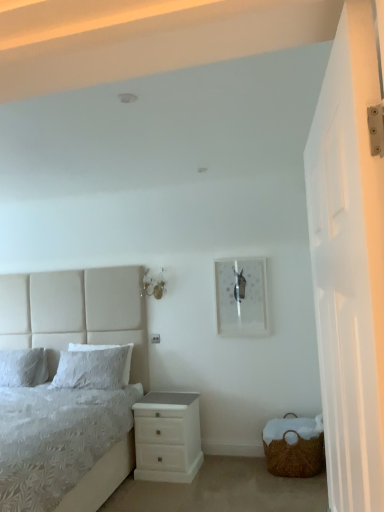
Where is `white soft pillow at left, which ranks as the 1th pillow in right-to-left order`? white soft pillow at left, which ranks as the 1th pillow in right-to-left order is located at coordinates (93, 367).

This screenshot has height=512, width=384. In order to click on metallic silver picture frame at center in this screenshot , I will do `click(241, 297)`.

The height and width of the screenshot is (512, 384). Describe the element at coordinates (76, 313) in the screenshot. I see `white fabric bed at left` at that location.

The height and width of the screenshot is (512, 384). I want to click on white fabric bed at left, so click(76, 313).

Describe the element at coordinates (293, 447) in the screenshot. This screenshot has width=384, height=512. I see `woven brown basket at lower right` at that location.

At what (x,y) coordinates should I click in order to perform the action: click on woven brown basket at lower right. Please return your answer as a coordinate pair (x, y). This screenshot has height=512, width=384. Looking at the image, I should click on point(293,447).

The height and width of the screenshot is (512, 384). Find the location of `white soft pillow at left, the 2th pillow in the right-to-left sequence`. white soft pillow at left, the 2th pillow in the right-to-left sequence is located at coordinates (x=23, y=367).

The height and width of the screenshot is (512, 384). In order to click on white glossy chest of drawers at lower right in this screenshot , I will do (167, 437).

Does metallic silver picture frame at center turn towards white fabric bed at left?

No, metallic silver picture frame at center is not turned towards white fabric bed at left.

Is metallic silver picture frame at center shorter than white fabric bed at left?

Yes, metallic silver picture frame at center is shorter than white fabric bed at left.

The height and width of the screenshot is (512, 384). I want to click on bed that is in front of the metallic silver picture frame at center, so click(76, 313).

Can you confirm if metallic silver picture frame at center is smaller than white fabric bed at left?

→ Indeed, metallic silver picture frame at center has a smaller size compared to white fabric bed at left.

In the scene shown: Is white soft pillow at left, the 2th pillow in the right-to-left sequence, positioned beyond the bounds of white glossy door at right?

Absolutely, white soft pillow at left, the 2th pillow in the right-to-left sequence, is external to white glossy door at right.

Considering the relative positions of white soft pillow at left, the 2th pillow in the right-to-left sequence, and white glossy door at right in the image provided, is white soft pillow at left, the 2th pillow in the right-to-left sequence, to the left of white glossy door at right from the viewer's perspective?

Indeed, white soft pillow at left, the 2th pillow in the right-to-left sequence, is positioned on the left side of white glossy door at right.

From a real-world perspective, is white soft pillow at left, marked as the 1th pillow in a left-to-right arrangement, located beneath white glossy door at right?

Indeed, from a real-world perspective, white soft pillow at left, marked as the 1th pillow in a left-to-right arrangement, is positioned beneath white glossy door at right.

Which of these two, white soft pillow at left, the 2th pillow in the right-to-left sequence, or white glossy door at right, is thinner?

Thinner between the two is white glossy door at right.

From a real-world perspective, is white fabric bed at left located beneath white soft pillow at left, which is the second pillow in left-to-right order?

No.

Who is more distant, white fabric bed at left or white soft pillow at left, which is the second pillow in left-to-right order?

white soft pillow at left, which is the second pillow in left-to-right order, is further away from the camera.

Can you confirm if white fabric bed at left is shorter than white soft pillow at left, which ranks as the 1th pillow in right-to-left order?

No.

Is white fabric bed at left looking in the opposite direction of white soft pillow at left, which ranks as the 1th pillow in right-to-left order?

Correct, white fabric bed at left is looking away from white soft pillow at left, which ranks as the 1th pillow in right-to-left order.

From the image's perspective, which one is positioned higher, woven brown basket at lower right or white soft pillow at left, the 2th pillow in the right-to-left sequence?

white soft pillow at left, the 2th pillow in the right-to-left sequence.

Which is closer, (268, 469) or (45, 368)?

Point (268, 469) is closer to the camera than point (45, 368).

How different are the orientations of woven brown basket at lower right and white soft pillow at left, marked as the 1th pillow in a left-to-right arrangement, in degrees?

The angle between the facing direction of woven brown basket at lower right and the facing direction of white soft pillow at left, marked as the 1th pillow in a left-to-right arrangement, is 1.73 degrees.

Is woven brown basket at lower right in front of or behind white soft pillow at left, marked as the 1th pillow in a left-to-right arrangement, in the image?

woven brown basket at lower right is in front of white soft pillow at left, marked as the 1th pillow in a left-to-right arrangement.

In the image, is white fabric bed at left positioned in front of or behind metallic silver picture frame at center?

white fabric bed at left is in front of metallic silver picture frame at center.

How different are the orientations of white fabric bed at left and metallic silver picture frame at center in degrees?

The angle between the facing direction of white fabric bed at left and the facing direction of metallic silver picture frame at center is 0.0123 degrees.

From the image's perspective, is white fabric bed at left under metallic silver picture frame at center?

Yes, from the image's perspective, white fabric bed at left is below metallic silver picture frame at center.

From a real-world perspective, between white fabric bed at left and metallic silver picture frame at center, who is vertically lower?

From a 3D spatial view, white fabric bed at left is below.

From a real-world perspective, is white fabric bed at left positioned under woven brown basket at lower right based on gravity?

No, from a real-world perspective, white fabric bed at left is not under woven brown basket at lower right.

Considering the relative sizes of white fabric bed at left and woven brown basket at lower right in the image provided, is white fabric bed at left shorter than woven brown basket at lower right?

Incorrect, the height of white fabric bed at left does not fall short of that of woven brown basket at lower right.

Based on their sizes in the image, would you say white fabric bed at left is bigger or smaller than woven brown basket at lower right?

Considering their sizes, white fabric bed at left takes up more space than woven brown basket at lower right.

Can you tell me how much white fabric bed at left and woven brown basket at lower right differ in facing direction?

There is a 0.512-degree angle between the facing directions of white fabric bed at left and woven brown basket at lower right.

Identify the location of basket that is below the white soft pillow at left, which is the second pillow in left-to-right order (from the image's perspective). (293, 447).

Which of these two, woven brown basket at lower right or white soft pillow at left, which is the second pillow in left-to-right order, is bigger?

woven brown basket at lower right is bigger.

Is woven brown basket at lower right beside white soft pillow at left, which is the second pillow in left-to-right order?

They are not placed beside each other.

Considering the sizes of objects woven brown basket at lower right and white soft pillow at left, which is the second pillow in left-to-right order, in the image provided, who is taller, woven brown basket at lower right or white soft pillow at left, which is the second pillow in left-to-right order,?

Standing taller between the two is white soft pillow at left, which is the second pillow in left-to-right order.

I want to click on bed below the metallic silver picture frame at center (from the image's perspective), so click(x=76, y=313).

The image size is (384, 512). What are the coordinates of `glass door above the white soft pillow at left, marked as the 1th pillow in a left-to-right arrangement (from a real-world perspective)` in the screenshot? It's located at (349, 264).

Looking at the image, which one is located closer to woven brown basket at lower right, white soft pillow at left, which ranks as the 1th pillow in right-to-left order, or white glossy chest of drawers at lower right?

white glossy chest of drawers at lower right is closer to woven brown basket at lower right.

When comparing their distances from white fabric bed at left, does white glossy door at right or metallic silver picture frame at center seem closer?

metallic silver picture frame at center.

Considering their positions, is white fabric bed at left positioned closer to white glossy door at right than white soft pillow at left, which ranks as the 1th pillow in right-to-left order?

white soft pillow at left, which ranks as the 1th pillow in right-to-left order, is positioned closer to the anchor white glossy door at right.

Estimate the real-world distances between objects in this image. Which object is closer to white soft pillow at left, which is the second pillow in left-to-right order, white glossy door at right or woven brown basket at lower right?

Based on the image, woven brown basket at lower right appears to be nearer to white soft pillow at left, which is the second pillow in left-to-right order.

Looking at the image, which one is located further to white soft pillow at left, which is the second pillow in left-to-right order, metallic silver picture frame at center or white fabric bed at left?

metallic silver picture frame at center.

Looking at the image, which one is located closer to woven brown basket at lower right, white glossy chest of drawers at lower right or white soft pillow at left, the 2th pillow in the right-to-left sequence?

Among the two, white glossy chest of drawers at lower right is located nearer to woven brown basket at lower right.

Estimate the real-world distances between objects in this image. Which object is closer to white glossy door at right, white soft pillow at left, which ranks as the 1th pillow in right-to-left order, or woven brown basket at lower right?

woven brown basket at lower right.

Considering their positions, is white soft pillow at left, the 2th pillow in the right-to-left sequence, positioned closer to woven brown basket at lower right than white glossy chest of drawers at lower right?

The object closer to woven brown basket at lower right is white glossy chest of drawers at lower right.

Identify the location of picture frame between white soft pillow at left, the 2th pillow in the right-to-left sequence, and woven brown basket at lower right. The width and height of the screenshot is (384, 512). (241, 297).

At what (x,y) coordinates should I click in order to perform the action: click on pillow between white soft pillow at left, the 2th pillow in the right-to-left sequence, and white glossy chest of drawers at lower right, in the horizontal direction. Please return your answer as a coordinate pair (x, y). Image resolution: width=384 pixels, height=512 pixels. Looking at the image, I should click on (93, 367).

Find the location of a particular element. bed between white soft pillow at left, the 2th pillow in the right-to-left sequence, and metallic silver picture frame at center, in the horizontal direction is located at coordinates (76, 313).

Identify the location of bed between white glossy door at right and metallic silver picture frame at center from front to back. The image size is (384, 512). (76, 313).